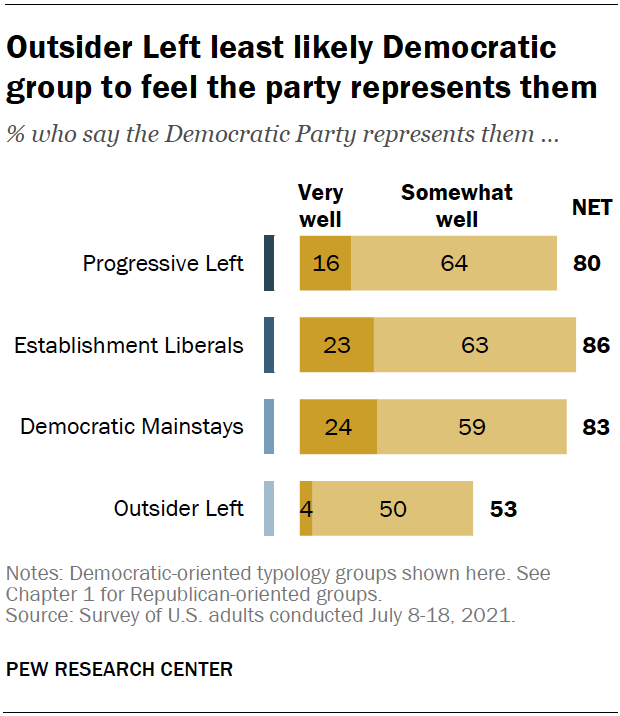
Identify the location of notes. This screenshot has height=716, width=620. (x=23, y=569).